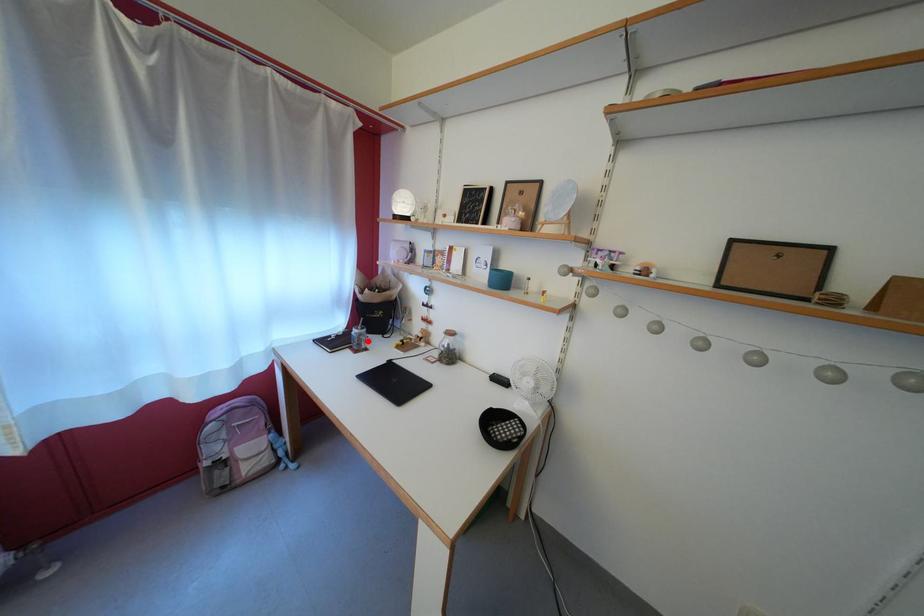
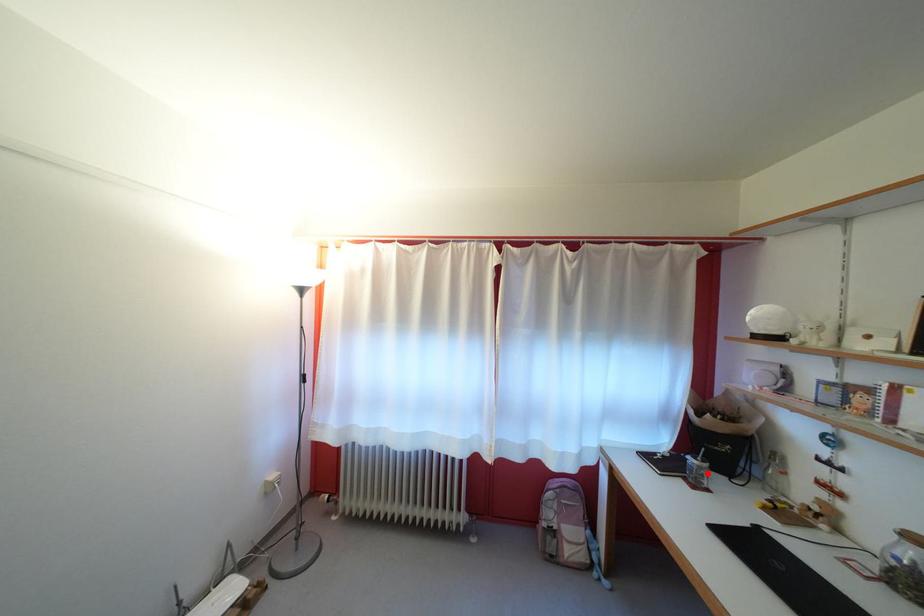
I am providing you with two images of the same scene from different viewpoints. A red point is marked on the first image and another point is marked on the second image. Are the points marked in image1 and image2 representing the same 3D position?

Yes